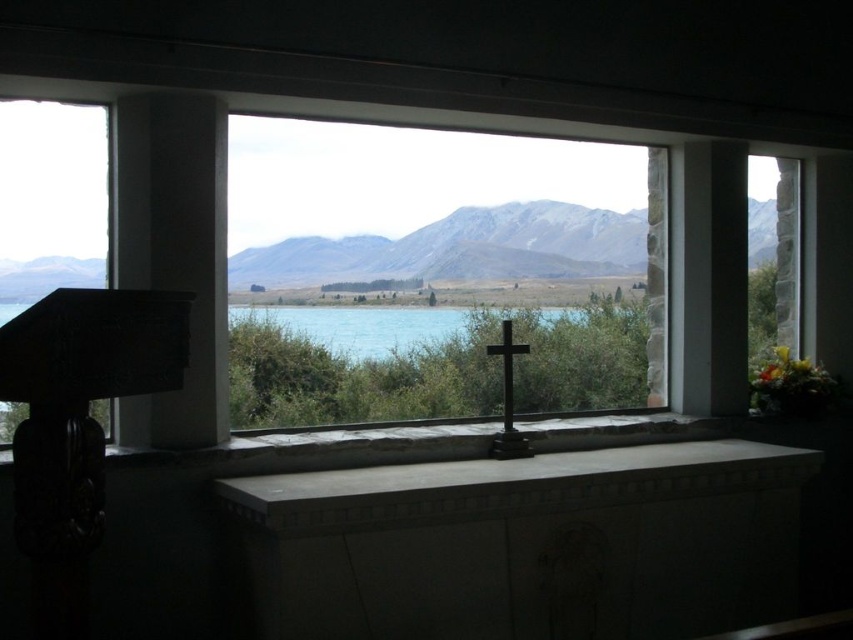
You are a window cleaner with a 30 cm long tool. You need to clean the transparent glass window at center and the turquoise water at center. Can your tool reach both objects from your current position?

The distance between the transparent glass window at center and the turquoise water at center is 33.74 centimeters. Since your tool is 30 cm long, it cannot reach the turquoise water at center, but it can reach the transparent glass window at center.